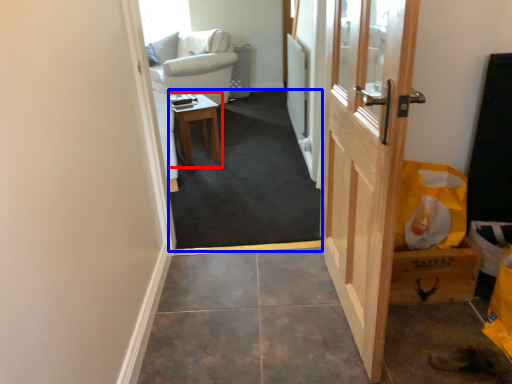
Question: Which of the following is the farthest to the observer, table (highlighted by a red box) or corridor (highlighted by a blue box)?

Choices:
 (A) table
 (B) corridor

Answer: (A)